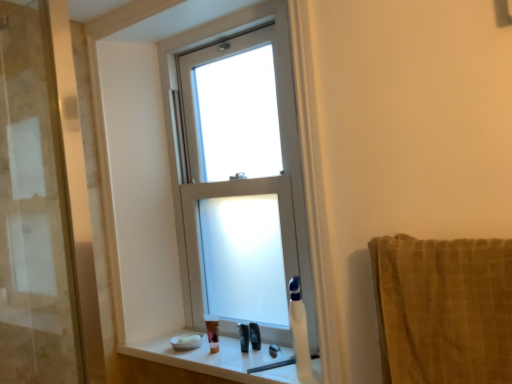
Question: Considering the relative sizes of white plastic soap dispenser at lower right and white frosted glass window at center in the image provided, is white plastic soap dispenser at lower right wider than white frosted glass window at center?

Choices:
 (A) no
 (B) yes

Answer: (B)

Question: Does white plastic soap dispenser at lower right touch white frosted glass window at center?

Choices:
 (A) no
 (B) yes

Answer: (A)

Question: Is white plastic soap dispenser at lower right at the right side of white frosted glass window at center?

Choices:
 (A) yes
 (B) no

Answer: (A)

Question: Is there a large distance between white plastic soap dispenser at lower right and white frosted glass window at center?

Choices:
 (A) yes
 (B) no

Answer: (B)

Question: Does white plastic soap dispenser at lower right have a smaller size compared to white frosted glass window at center?

Choices:
 (A) yes
 (B) no

Answer: (A)

Question: Is brown textured towel at right situated inside white glossy window sill at lower center or outside?

Choices:
 (A) outside
 (B) inside

Answer: (A)

Question: In terms of size, does brown textured towel at right appear bigger or smaller than white glossy window sill at lower center?

Choices:
 (A) big
 (B) small

Answer: (A)

Question: Is brown textured towel at right to the left or to the right of white glossy window sill at lower center in the image?

Choices:
 (A) right
 (B) left

Answer: (A)

Question: From a real-world perspective, is brown textured towel at right positioned above or below white glossy window sill at lower center?

Choices:
 (A) above
 (B) below

Answer: (A)

Question: From the image's perspective, is black plastic razor at lower center, marked as the 1th toiletry in a right-to-left arrangement, located above or below brown textured towel at right?

Choices:
 (A) below
 (B) above

Answer: (A)

Question: Looking at the image, does black plastic razor at lower center, which is the 3th toiletry in left-to-right order, seem bigger or smaller compared to brown textured towel at right?

Choices:
 (A) small
 (B) big

Answer: (A)

Question: Visually, is black plastic razor at lower center, marked as the 1th toiletry in a right-to-left arrangement, positioned to the left or to the right of brown textured towel at right?

Choices:
 (A) left
 (B) right

Answer: (A)

Question: Is point (253, 324) positioned closer to the camera than point (510, 261)?

Choices:
 (A) closer
 (B) farther

Answer: (B)

Question: Looking at the image, does translucent plastic toothbrush at lower center, which is the second toiletry in right-to-left order, seem bigger or smaller compared to translucent plastic soap at lower center, acting as the 1th toiletry starting from the left?

Choices:
 (A) big
 (B) small

Answer: (B)

Question: In the image, is translucent plastic toothbrush at lower center, the second toiletry in the left-to-right sequence, on the left side or the right side of translucent plastic soap at lower center, acting as the 1th toiletry starting from the left?

Choices:
 (A) right
 (B) left

Answer: (A)